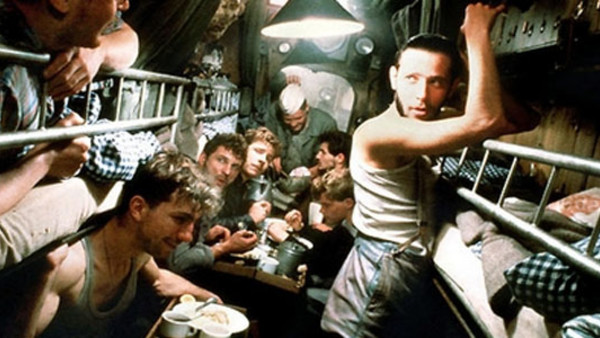
The height and width of the screenshot is (338, 600). I want to click on pillow, so click(559, 264).